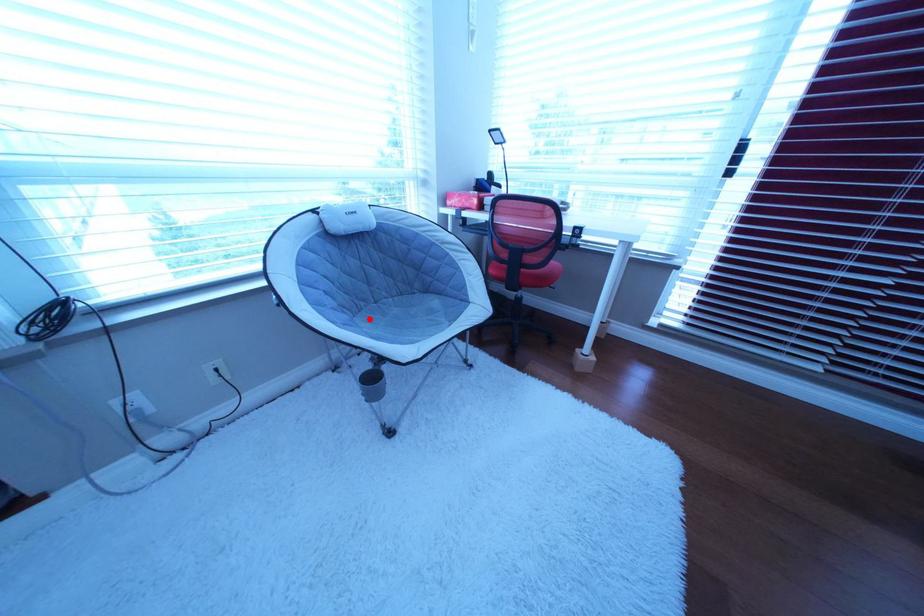
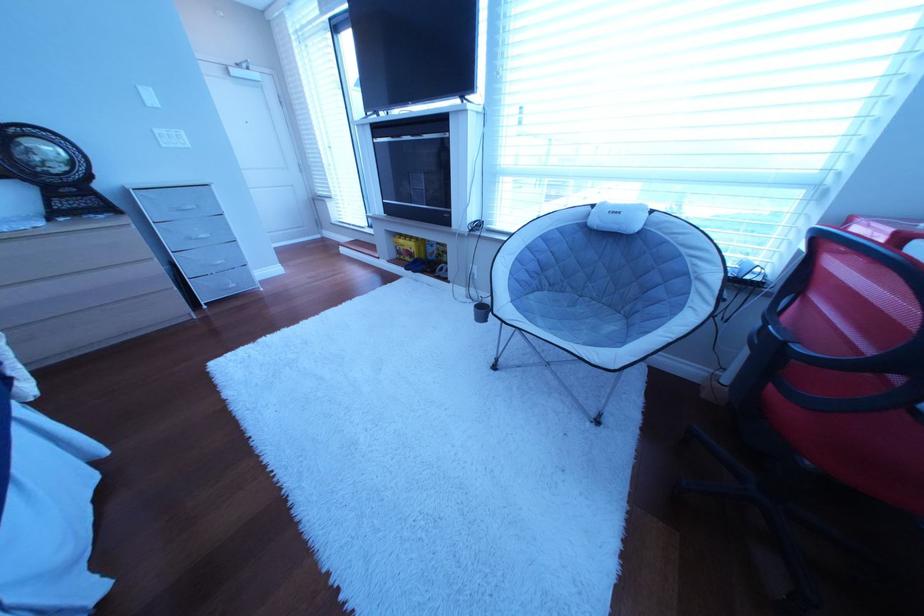
Question: I am providing you with two images of the same scene from different viewpoints. Image1 has a red point marked. In image2, the corresponding 3D location appears at what relative position? Reply with the corresponding letter.

Choices:
 (A) Closer
 (B) Farther

Answer: (B)